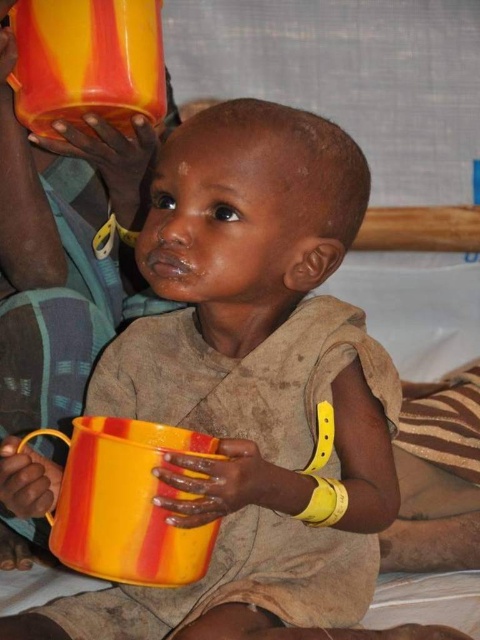
Question: Which object appears closest to the camera in this image?

Choices:
 (A) yellow/red striped cup at upper left
 (B) yellow striped mug at center

Answer: (B)

Question: Is yellow striped mug at center below yellow/red striped cup at upper left?

Choices:
 (A) yes
 (B) no

Answer: (A)

Question: Does yellow striped mug at center lie in front of yellow/red striped cup at upper left?

Choices:
 (A) yes
 (B) no

Answer: (A)

Question: Does yellow striped mug at center have a greater width compared to yellow/red striped cup at upper left?

Choices:
 (A) yes
 (B) no

Answer: (A)